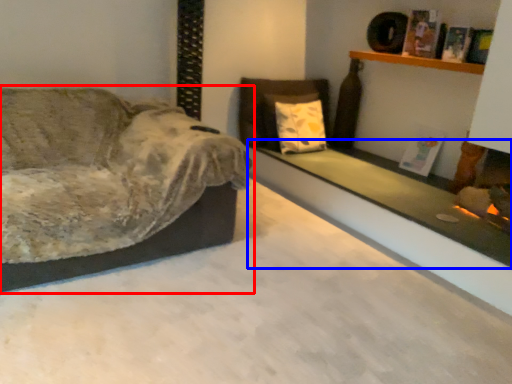
Question: Which object is closer to the camera taking this photo, studio couch (highlighted by a red box) or ledge (highlighted by a blue box)?

Choices:
 (A) studio couch
 (B) ledge

Answer: (A)